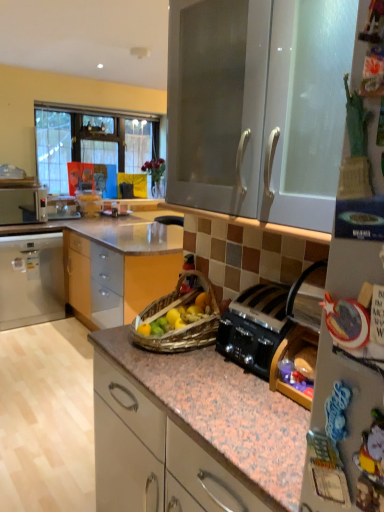
What are the coordinates of `matte white cabinet at left, the second cabinetry from the front` in the screenshot? It's located at (31, 279).

What do you see at coordinates (254, 327) in the screenshot? The image size is (384, 512). I see `black metallic toaster at center-right` at bounding box center [254, 327].

I want to click on white glossy cabinet at upper center, positioned as the 2th cabinetry in back-to-front order, so click(258, 106).

Is black metallic toaster at center-right oriented towards white glossy cabinet at upper center, which is the 2th cabinetry from left to right?

No, black metallic toaster at center-right is not turned towards white glossy cabinet at upper center, which is the 2th cabinetry from left to right.

Considering the relative positions of black metallic toaster at center-right and white glossy cabinet at upper center, which is the 2th cabinetry from left to right, in the image provided, is black metallic toaster at center-right to the left of white glossy cabinet at upper center, which is the 2th cabinetry from left to right, from the viewer's perspective?

No.

Considering the positions of point (257, 339) and point (203, 97), is point (257, 339) closer or farther from the camera than point (203, 97)?

Point (257, 339) appears to be closer to the viewer than point (203, 97).

Based on their sizes in the image, would you say white glossy cabinet at upper center, positioned as the 2th cabinetry in back-to-front order, is bigger or smaller than black metallic toaster at center-right?

Clearly, white glossy cabinet at upper center, positioned as the 2th cabinetry in back-to-front order, is larger in size than black metallic toaster at center-right.

From the image's perspective, which is below, white glossy cabinet at upper center, the first cabinetry in the right-to-left sequence, or black metallic toaster at center-right?

From the image's view, black metallic toaster at center-right is below.

Is white glossy cabinet at upper center, which is the 2th cabinetry from left to right, outside of black metallic toaster at center-right?

white glossy cabinet at upper center, which is the 2th cabinetry from left to right, lies outside black metallic toaster at center-right's area.

Considering the positions of objects white glossy cabinet at upper center, positioned as the 2th cabinetry in back-to-front order, and matte white cabinet at left, the second cabinetry in the right-to-left sequence, in the image provided, who is in front, white glossy cabinet at upper center, positioned as the 2th cabinetry in back-to-front order, or matte white cabinet at left, the second cabinetry in the right-to-left sequence,?

Positioned in front is white glossy cabinet at upper center, positioned as the 2th cabinetry in back-to-front order.

Considering the sizes of objects white glossy cabinet at upper center, the first cabinetry from the front, and matte white cabinet at left, which is the first cabinetry in back-to-front order, in the image provided, who is thinner, white glossy cabinet at upper center, the first cabinetry from the front, or matte white cabinet at left, which is the first cabinetry in back-to-front order,?

white glossy cabinet at upper center, the first cabinetry from the front.

Between white glossy cabinet at upper center, the first cabinetry from the front, and matte white cabinet at left, the first cabinetry from the left, which one has less height?

white glossy cabinet at upper center, the first cabinetry from the front, is shorter.

From the image's perspective, is white plastic microwave at left above black metallic toaster at center-right?

Yes.

Does white plastic microwave at left lie behind black metallic toaster at center-right?

Yes, it is behind black metallic toaster at center-right.

Based on the photo, how far apart are white plastic microwave at left and black metallic toaster at center-right?

A distance of 3.10 meters exists between white plastic microwave at left and black metallic toaster at center-right.

Which of these two, white glossy cabinet at upper center, the first cabinetry in the right-to-left sequence, or white plastic microwave at left, is bigger?

With larger size is white glossy cabinet at upper center, the first cabinetry in the right-to-left sequence.

How far apart are white glossy cabinet at upper center, the first cabinetry in the right-to-left sequence, and white plastic microwave at left?

3.03 meters.

From the picture: Which object is thinner, white glossy cabinet at upper center, which is the 2th cabinetry from left to right, or white plastic microwave at left?

Thinner between the two is white glossy cabinet at upper center, which is the 2th cabinetry from left to right.

From a real-world perspective, is white glossy cabinet at upper center, positioned as the 2th cabinetry in back-to-front order, on top of white plastic microwave at left?

Yes, from a real-world perspective, white glossy cabinet at upper center, positioned as the 2th cabinetry in back-to-front order, is on top of white plastic microwave at left.

Could you tell me if white plastic microwave at left is facing matte white cabinet at left, the first cabinetry from the left?

No, white plastic microwave at left is not aimed at matte white cabinet at left, the first cabinetry from the left.

Considering the positions of objects white plastic microwave at left and matte white cabinet at left, the first cabinetry from the left, in the image provided, who is more to the left, white plastic microwave at left or matte white cabinet at left, the first cabinetry from the left,?

Positioned to the left is white plastic microwave at left.

Which is behind, point (22, 219) or point (23, 302)?

Positioned behind is point (22, 219).

From the picture: Does matte white cabinet at left, the second cabinetry in the right-to-left sequence, have a lesser height compared to white glossy cabinet at upper center, the first cabinetry in the right-to-left sequence?

Incorrect, the height of matte white cabinet at left, the second cabinetry in the right-to-left sequence, does not fall short of that of white glossy cabinet at upper center, the first cabinetry in the right-to-left sequence.

Where is `cabinetry above the matte white cabinet at left, the second cabinetry in the right-to-left sequence (from a real-world perspective)`? Image resolution: width=384 pixels, height=512 pixels. cabinetry above the matte white cabinet at left, the second cabinetry in the right-to-left sequence (from a real-world perspective) is located at coordinates (258, 106).

Could you tell me if matte white cabinet at left, the second cabinetry in the right-to-left sequence, is facing white glossy cabinet at upper center, which is the 2th cabinetry from left to right?

Yes, matte white cabinet at left, the second cabinetry in the right-to-left sequence, is facing white glossy cabinet at upper center, which is the 2th cabinetry from left to right.

Where is `the 1st cabinetry to the left of the black metallic toaster at center-right, counting from the anchor's position`? Image resolution: width=384 pixels, height=512 pixels. the 1st cabinetry to the left of the black metallic toaster at center-right, counting from the anchor's position is located at coordinates (258, 106).

In the image, there is a white glossy cabinet at upper center, which is the 2th cabinetry from left to right. In order to click on kitchen appliance below it (from a real-world perspective) in this screenshot , I will do `click(254, 327)`.

Estimate the real-world distances between objects in this image. Which object is further from white glossy cabinet at upper center, the first cabinetry in the right-to-left sequence, black metallic toaster at center-right or white plastic microwave at left?

white plastic microwave at left lies further to white glossy cabinet at upper center, the first cabinetry in the right-to-left sequence, than the other object.

From the image, which object appears to be farther from matte white cabinet at left, the second cabinetry from the front, white plastic microwave at left or white glossy cabinet at upper center, positioned as the 2th cabinetry in back-to-front order?

white glossy cabinet at upper center, positioned as the 2th cabinetry in back-to-front order, lies further to matte white cabinet at left, the second cabinetry from the front, than the other object.

From the image, which object appears to be farther from white plastic microwave at left, black metallic toaster at center-right or matte white cabinet at left, the first cabinetry from the left?

Based on the image, black metallic toaster at center-right appears to be further to white plastic microwave at left.

From the image, which object appears to be farther from white plastic microwave at left, matte white cabinet at left, which is the first cabinetry in back-to-front order, or black metallic toaster at center-right?

black metallic toaster at center-right is further to white plastic microwave at left.

When comparing their distances from white glossy cabinet at upper center, positioned as the 2th cabinetry in back-to-front order, does white plastic microwave at left or black metallic toaster at center-right seem closer?

Based on the image, black metallic toaster at center-right appears to be nearer to white glossy cabinet at upper center, positioned as the 2th cabinetry in back-to-front order.

Based on their spatial positions, is white glossy cabinet at upper center, positioned as the 2th cabinetry in back-to-front order, or black metallic toaster at center-right further from matte white cabinet at left, which is the first cabinetry in back-to-front order?

black metallic toaster at center-right lies further to matte white cabinet at left, which is the first cabinetry in back-to-front order, than the other object.

Estimate the real-world distances between objects in this image. Which object is further from white glossy cabinet at upper center, the first cabinetry in the right-to-left sequence, white plastic microwave at left or matte white cabinet at left, the second cabinetry from the front?

The object further to white glossy cabinet at upper center, the first cabinetry in the right-to-left sequence, is white plastic microwave at left.

Looking at the image, which one is located further to white glossy cabinet at upper center, which is the 2th cabinetry from left to right, matte white cabinet at left, the first cabinetry from the left, or black metallic toaster at center-right?

Among the two, matte white cabinet at left, the first cabinetry from the left, is located further to white glossy cabinet at upper center, which is the 2th cabinetry from left to right.

Locate an element on the screen. Image resolution: width=384 pixels, height=512 pixels. kitchen appliance between white glossy cabinet at upper center, the first cabinetry from the front, and white plastic microwave at left, along the z-axis is located at coordinates (254, 327).

Image resolution: width=384 pixels, height=512 pixels. What are the coordinates of `cabinetry between black metallic toaster at center-right and white plastic microwave at left in the front-back direction` in the screenshot? It's located at (31, 279).

Find the location of a particular element. The height and width of the screenshot is (512, 384). cabinetry between white glossy cabinet at upper center, the first cabinetry from the front, and white plastic microwave at left from front to back is located at coordinates (31, 279).

You are a GUI agent. You are given a task and a screenshot of the screen. Output one action in this format:
    pyautogui.click(x=<x>, y=<y>)
    Task: Click on the kitchen appliance located between white glossy cabinet at upper center, positioned as the 2th cabinetry in back-to-front order, and matte white cabinet at left, the second cabinetry in the right-to-left sequence, in the depth direction
    The height and width of the screenshot is (512, 384).
    Given the screenshot: What is the action you would take?
    pyautogui.click(x=254, y=327)